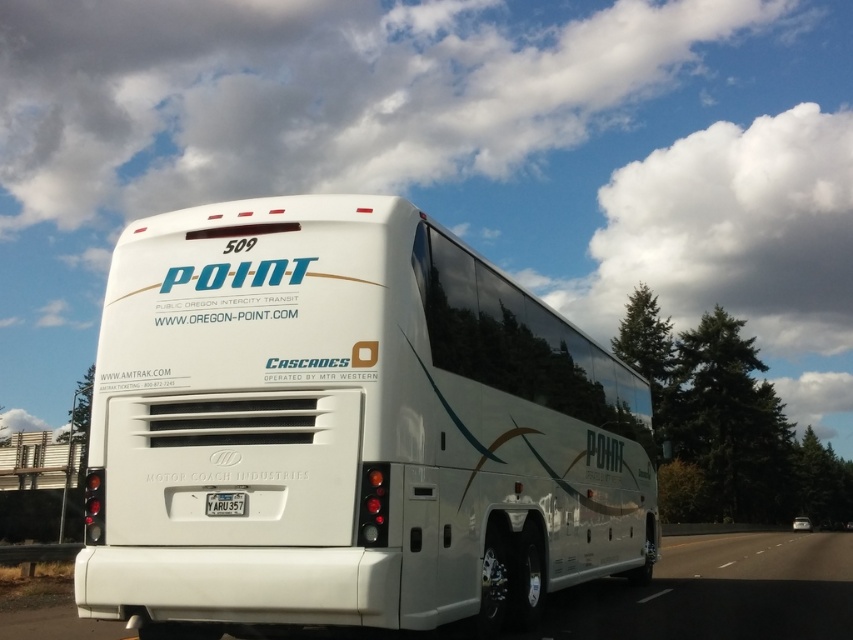
You are a passenger on the bus and want to exit the bus through the rear door. You see the white glossy highway at lower right and the yellow matte license plate at center. Which object is closer to the right side of the bus?

The white glossy highway at lower right is closer to the right side of the bus because it is positioned to the right of the yellow matte license plate at center.

A maintenance worker needs to reach a point located at (548, 385) on the bus. The worker has a ladder that is 7.79 meters long. If the worker stands at the base of the bus, will the ladder be long enough to reach the point?

The distance between the worker at the base of the bus and the point is 7.79 meters, so the ladder is exactly long enough to reach the point.

You are standing in front of the bus and notice two points marked on its rear. The first point is at coordinates point [693,577] and the second is at point [229,515]. Which point is closer to you?

Point [693,577] is further to the viewer than point [229,515], so the second point is closer to you.